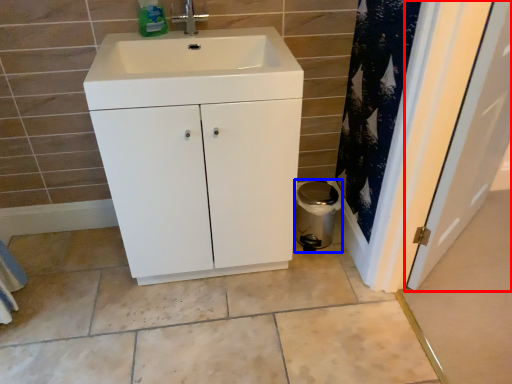
Question: Which of the following is the farthest to the observer, door (highlighted by a red box) or appliance (highlighted by a blue box)?

Choices:
 (A) door
 (B) appliance

Answer: (B)